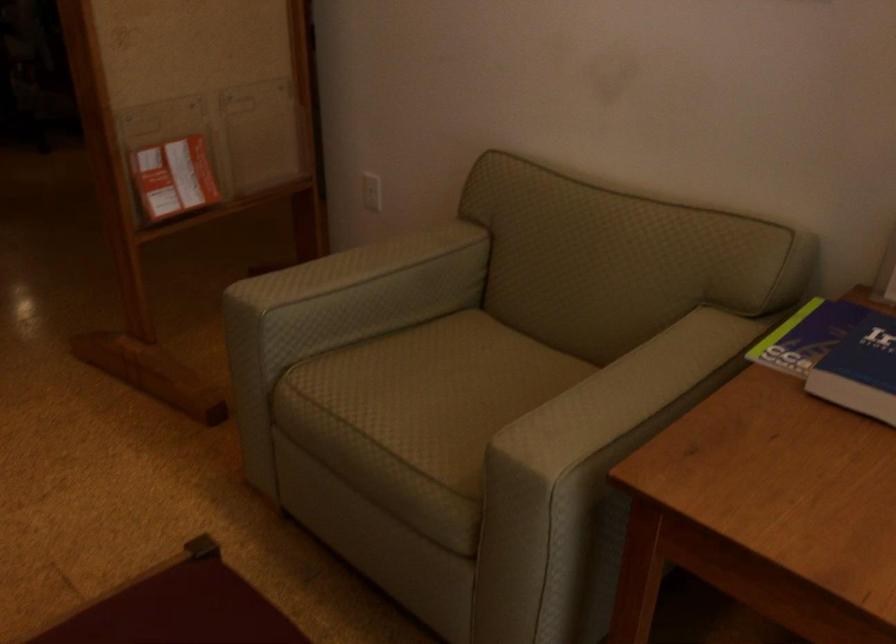
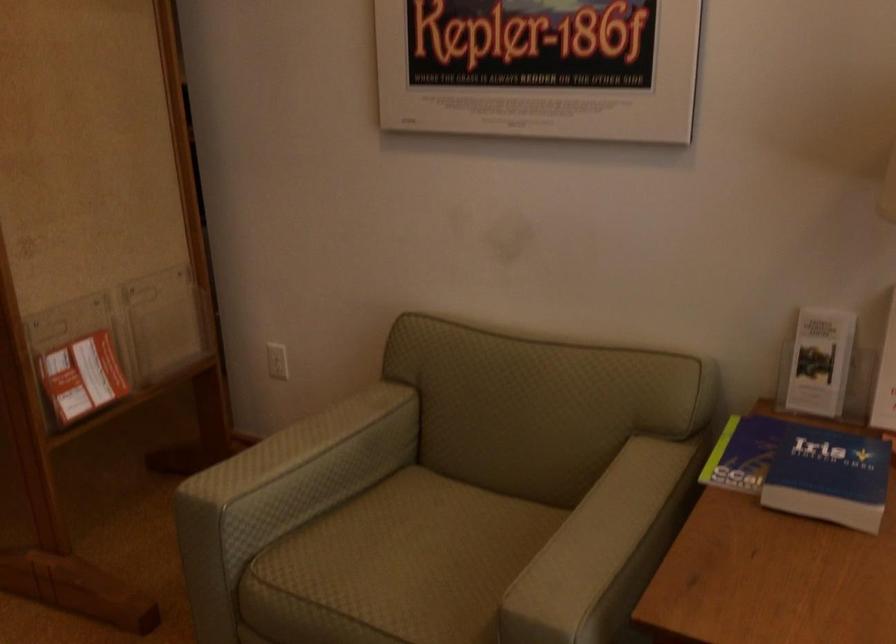
The point at [366,187] is marked in the first image. Where is the corresponding point in the second image?

(277, 361)